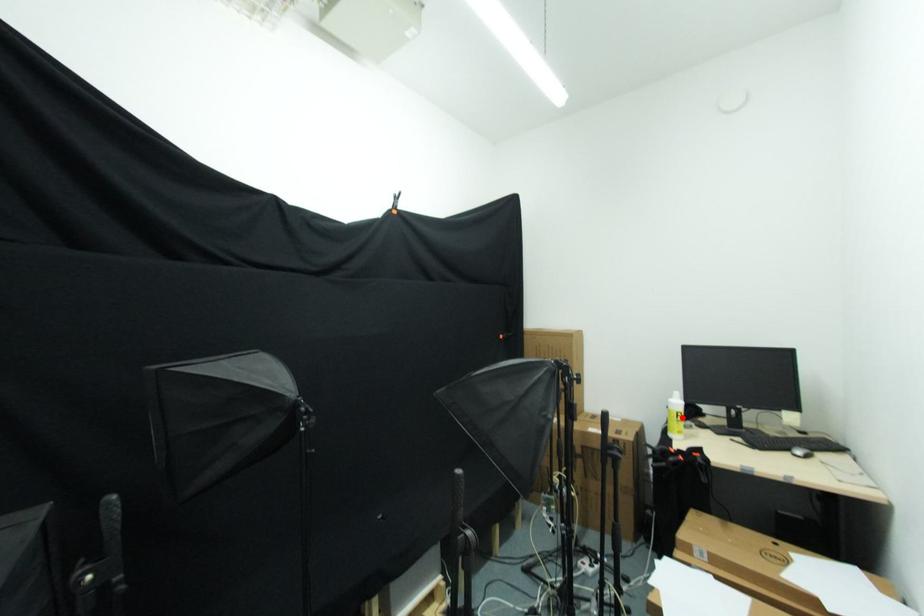
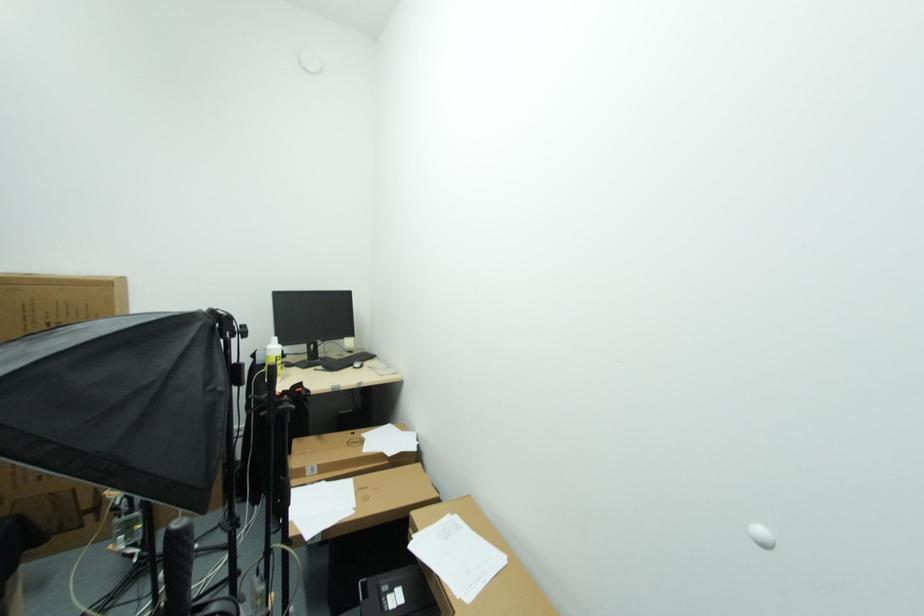
Locate, in the second image, the point that corresponds to the highlighted location in the first image.

(280, 361)